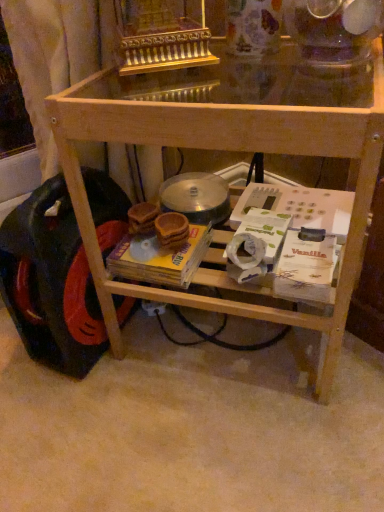
Question: Is yellow cardboard magazine at center wider than black rubber wheel at lower left?

Choices:
 (A) yes
 (B) no

Answer: (B)

Question: From a real-world perspective, does yellow cardboard magazine at center stand above black rubber wheel at lower left?

Choices:
 (A) no
 (B) yes

Answer: (B)

Question: Does yellow cardboard magazine at center come in front of black rubber wheel at lower left?

Choices:
 (A) yes
 (B) no

Answer: (B)

Question: From the image's perspective, is yellow cardboard magazine at center above black rubber wheel at lower left?

Choices:
 (A) yes
 (B) no

Answer: (B)

Question: Is yellow cardboard magazine at center positioned behind black rubber wheel at lower left?

Choices:
 (A) no
 (B) yes

Answer: (B)

Question: Considering the positions of black rubber wheel at lower left and yellow cardboard magazine at center in the image, is black rubber wheel at lower left wider or thinner than yellow cardboard magazine at center?

Choices:
 (A) wide
 (B) thin

Answer: (A)

Question: Based on their positions, is black rubber wheel at lower left located to the left or right of yellow cardboard magazine at center?

Choices:
 (A) right
 (B) left

Answer: (B)

Question: Would you say black rubber wheel at lower left is inside or outside yellow cardboard magazine at center?

Choices:
 (A) inside
 (B) outside

Answer: (B)

Question: From the image's perspective, relative to yellow cardboard magazine at center, is black rubber wheel at lower left above or below?

Choices:
 (A) below
 (B) above

Answer: (B)

Question: Is yellow cardboard magazine at center situated inside black rubber wheel at lower left or outside?

Choices:
 (A) inside
 (B) outside

Answer: (B)

Question: Visually, is yellow cardboard magazine at center positioned to the left or to the right of black rubber wheel at lower left?

Choices:
 (A) right
 (B) left

Answer: (A)

Question: Is yellow cardboard magazine at center wider or thinner than black rubber wheel at lower left?

Choices:
 (A) thin
 (B) wide

Answer: (A)

Question: Is yellow cardboard magazine at center in front of or behind black rubber wheel at lower left in the image?

Choices:
 (A) behind
 (B) front

Answer: (A)

Question: Based on their positions, is natural wood table at center located to the left or right of yellow cardboard magazine at center?

Choices:
 (A) right
 (B) left

Answer: (A)

Question: From a real-world perspective, is natural wood table at center physically located above or below yellow cardboard magazine at center?

Choices:
 (A) above
 (B) below

Answer: (A)